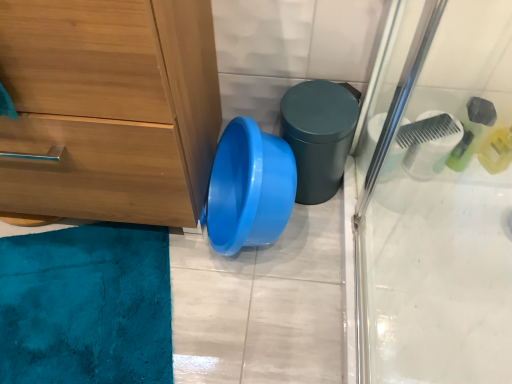
Identify the location of matte green potty at center. This screenshot has width=512, height=384. (319, 135).

What is the approximate width of matte green potty at center?

matte green potty at center is 7.62 inches wide.

What do you see at coordinates (319, 135) in the screenshot? I see `matte green potty at center` at bounding box center [319, 135].

Consider the image. What is the approximate height of matte green potty at center?

The height of matte green potty at center is 10.63 inches.

Locate an element on the screen. Image resolution: width=512 pixels, height=384 pixels. wooden chest of drawers at left is located at coordinates (109, 108).

This screenshot has width=512, height=384. Describe the element at coordinates (109, 108) in the screenshot. I see `wooden chest of drawers at left` at that location.

Identify the location of matte green potty at center. (319, 135).

Considering the positions of objects matte green potty at center and wooden chest of drawers at left in the image provided, who is more to the right, matte green potty at center or wooden chest of drawers at left?

Positioned to the right is matte green potty at center.

Is matte green potty at center closer to camera compared to wooden chest of drawers at left?

No, it is not.

Considering the points (330, 177) and (165, 101), which point is behind, point (330, 177) or point (165, 101)?

The point (330, 177) is farther from the camera.

From the image's perspective, which is below, matte green potty at center or wooden chest of drawers at left?

matte green potty at center.

From a real-world perspective, who is located lower, matte green potty at center or wooden chest of drawers at left?

matte green potty at center, from a real-world perspective.

Considering the sizes of objects matte green potty at center and wooden chest of drawers at left in the image provided, who is thinner, matte green potty at center or wooden chest of drawers at left?

Thinner between the two is matte green potty at center.

From the picture: Does matte green potty at center have a greater height compared to wooden chest of drawers at left?

Incorrect, the height of matte green potty at center is not larger of that of wooden chest of drawers at left.

Looking at the image, does matte green potty at center seem bigger or smaller compared to wooden chest of drawers at left?

In the image, matte green potty at center appears to be smaller than wooden chest of drawers at left.

Choose the correct answer: Is matte green potty at center inside wooden chest of drawers at left or outside it?

The correct answer is: outside.

Does matte green potty at center touch wooden chest of drawers at left?

No, matte green potty at center is not next to wooden chest of drawers at left.

Is matte green potty at center looking in the opposite direction of wooden chest of drawers at left?

No, matte green potty at center is not facing the opposite direction of wooden chest of drawers at left.

Can you tell me how much matte green potty at center and wooden chest of drawers at left differ in facing direction?

The angle between the facing direction of matte green potty at center and the facing direction of wooden chest of drawers at left is 2.88 degrees.

This screenshot has height=384, width=512. I want to click on potty beneath the wooden chest of drawers at left (from a real-world perspective), so click(319, 135).

Between wooden chest of drawers at left and matte green potty at center, which one appears on the right side from the viewer's perspective?

matte green potty at center is more to the right.

Which object is more forward, wooden chest of drawers at left or matte green potty at center?

wooden chest of drawers at left is closer to the camera.

Between point (153, 78) and point (332, 83), which one is positioned in front?

Point (153, 78)

From the image's perspective, is wooden chest of drawers at left under matte green potty at center?

No.

From a real-world perspective, is wooden chest of drawers at left under matte green potty at center?

No, from a real-world perspective, wooden chest of drawers at left is not beneath matte green potty at center.

In the scene shown: Can you confirm if wooden chest of drawers at left is wider than matte green potty at center?

Yes.

Considering the relative sizes of wooden chest of drawers at left and matte green potty at center in the image provided, is wooden chest of drawers at left taller than matte green potty at center?

Correct, wooden chest of drawers at left is much taller as matte green potty at center.

Is wooden chest of drawers at left smaller than matte green potty at center?

No.

Which is correct: wooden chest of drawers at left is inside matte green potty at center, or outside of it?

wooden chest of drawers at left is not enclosed by matte green potty at center.

Is wooden chest of drawers at left not near matte green potty at center?

No, there isn't a large distance between wooden chest of drawers at left and matte green potty at center.

Is wooden chest of drawers at left facing away from matte green potty at center?

No, matte green potty at center is not at the back of wooden chest of drawers at left.

Find the location of `chest of drawers in front of the matte green potty at center`. chest of drawers in front of the matte green potty at center is located at coordinates (109, 108).

At what (x,y) coordinates should I click in order to perform the action: click on chest of drawers on the left of matte green potty at center. Please return your answer as a coordinate pair (x, y). Looking at the image, I should click on (109, 108).

Identify the location of the chest of drawers above the matte green potty at center (from the image's perspective). Image resolution: width=512 pixels, height=384 pixels. (109, 108).